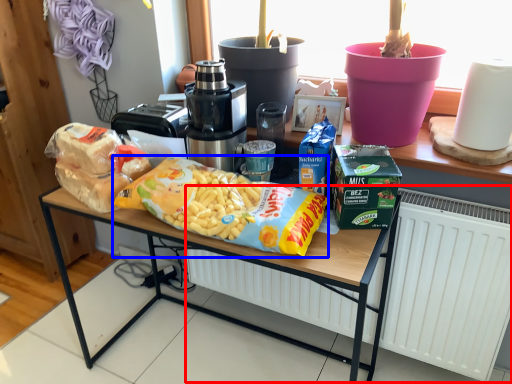
Question: Which point is closer to the camera, radiator (highlighted by a red box) or cereal (highlighted by a blue box)?

Choices:
 (A) radiator
 (B) cereal

Answer: (B)